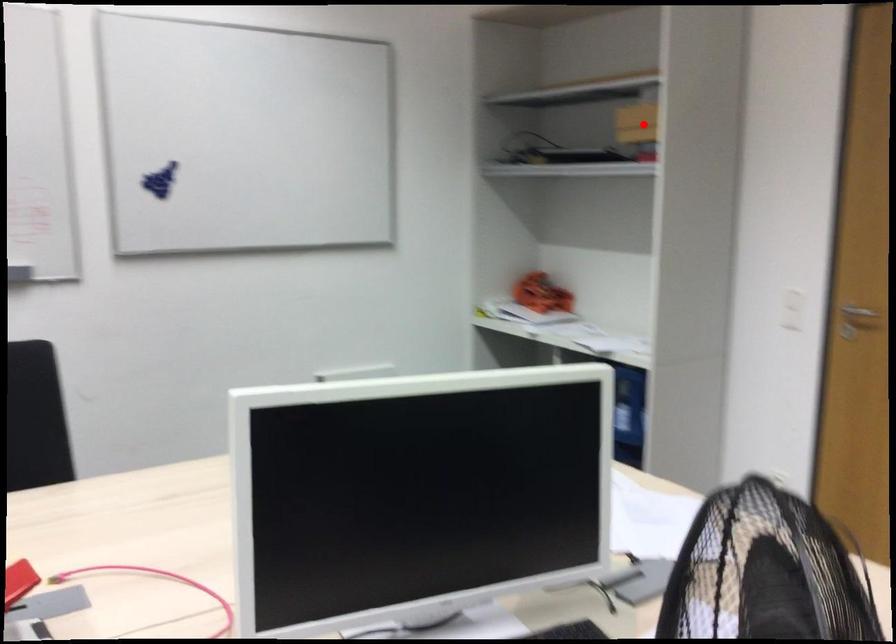
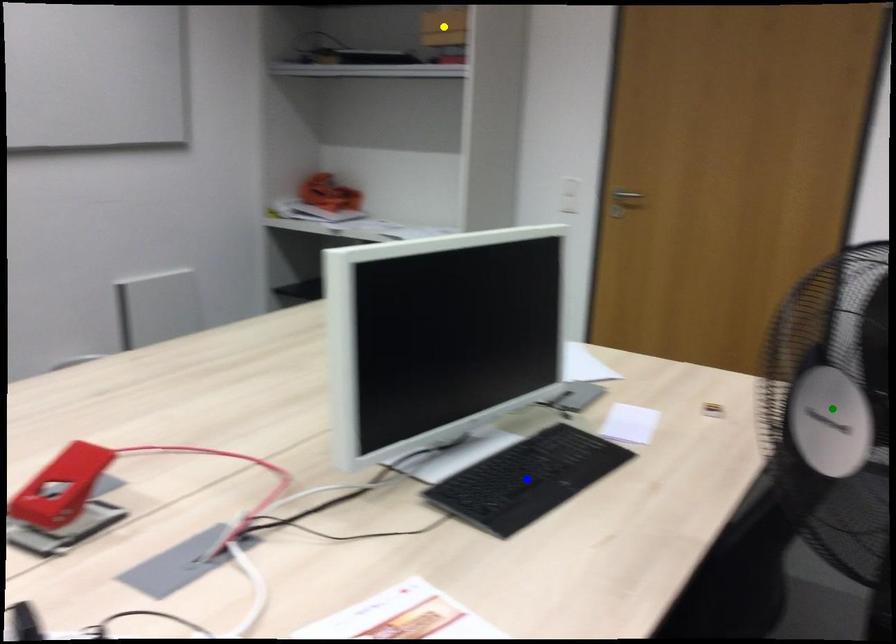
Question: I am providing you with two images of the same scene from different viewpoints. A red point is marked on the first image. You are given multiple points on the second image. Can you choose the point in image 2 that corresponds to the point in image 1?

Choices:
 (A) yellow point
 (B) green point
 (C) blue point

Answer: (A)